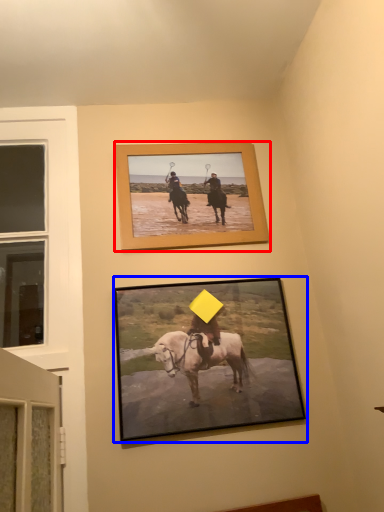
Question: Which object appears closest to the camera in this image, picture frame (highlighted by a red box) or picture frame (highlighted by a blue box)?

Choices:
 (A) picture frame
 (B) picture frame

Answer: (B)